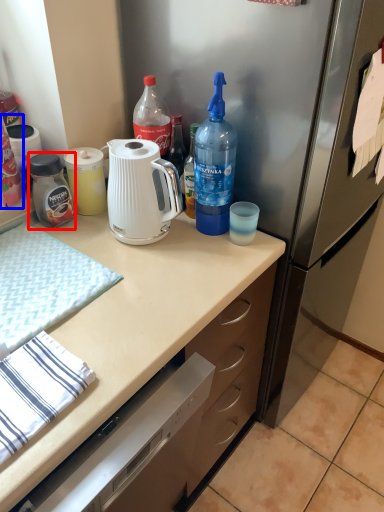
Question: Which object appears closest to the camera in this image, bottle (highlighted by a red box) or bottle (highlighted by a blue box)?

Choices:
 (A) bottle
 (B) bottle

Answer: (B)